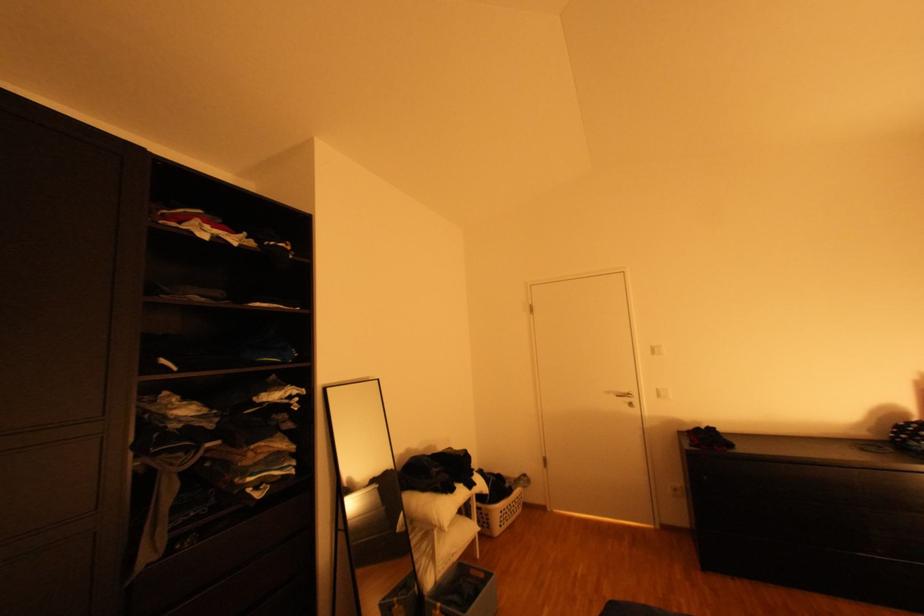
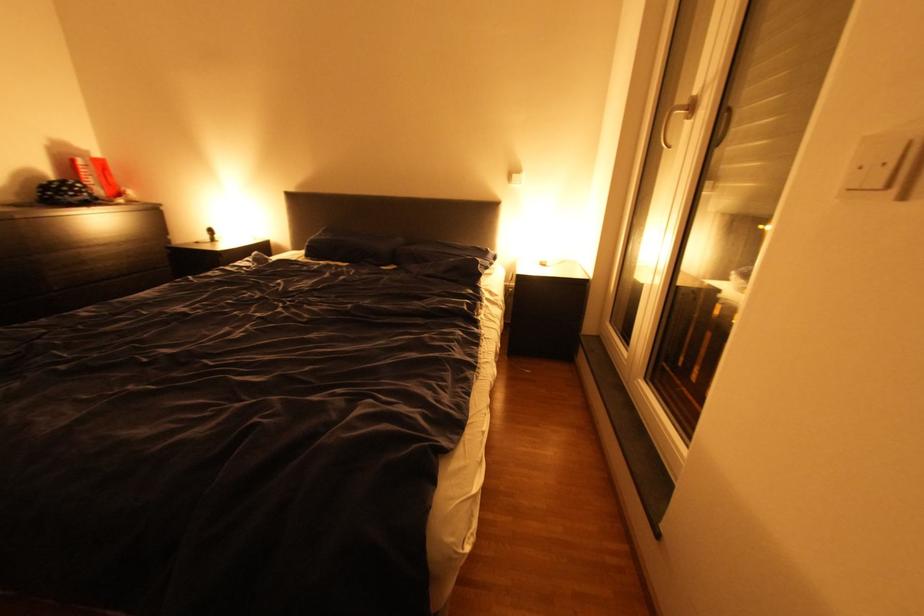
The first image is from the beginning of the video and the second image is from the end. How did the camera likely rotate when shooting the video?

The rotation direction of the camera is right-down.